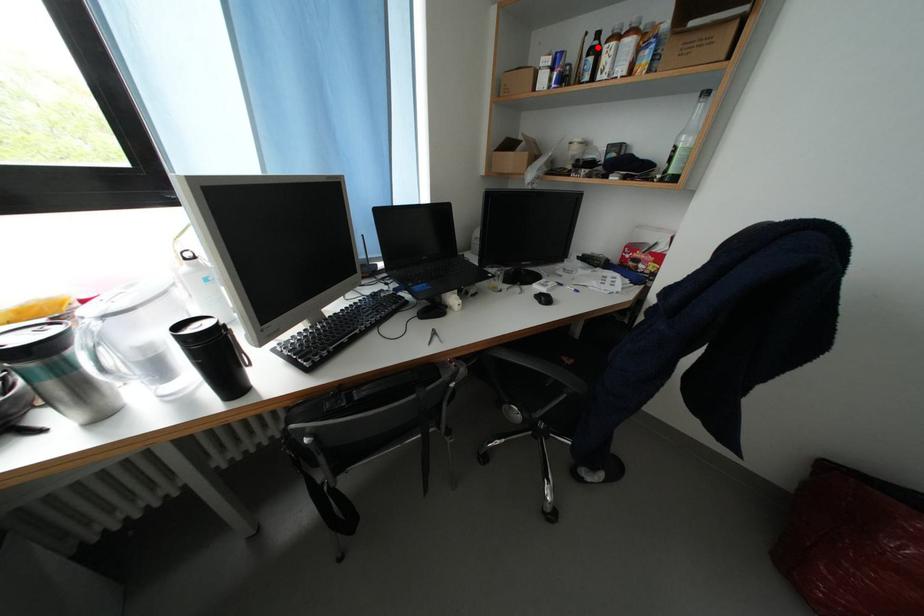
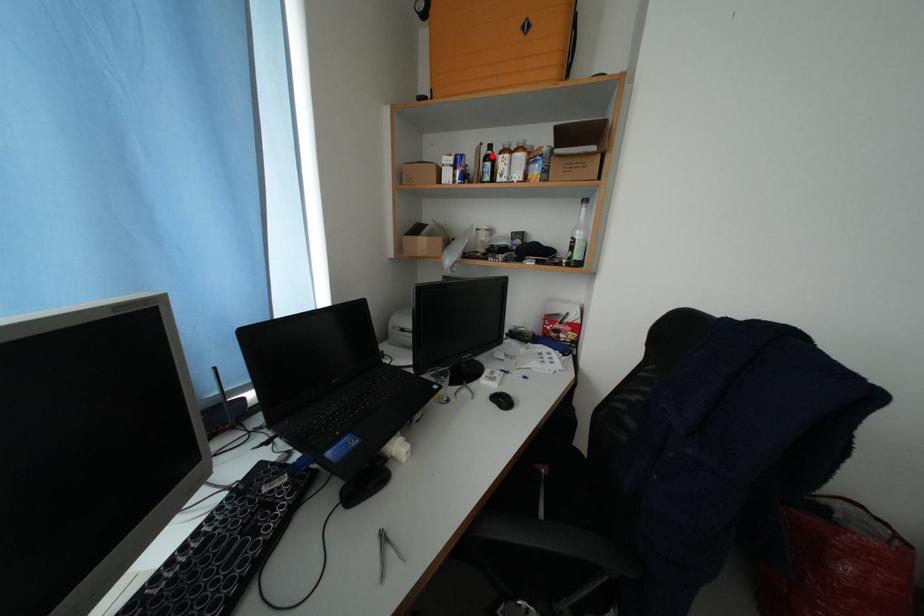
I am providing you with two images of the same scene from different viewpoints. A red point is marked on the first image and another point is marked on the second image. Is the red point in image1 aligned with the point shown in image2?

Yes